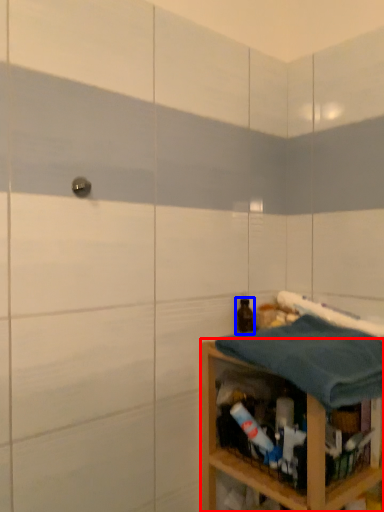
Question: Which object is closer to the camera taking this photo, shelf (highlighted by a red box) or bottle (highlighted by a blue box)?

Choices:
 (A) shelf
 (B) bottle

Answer: (A)